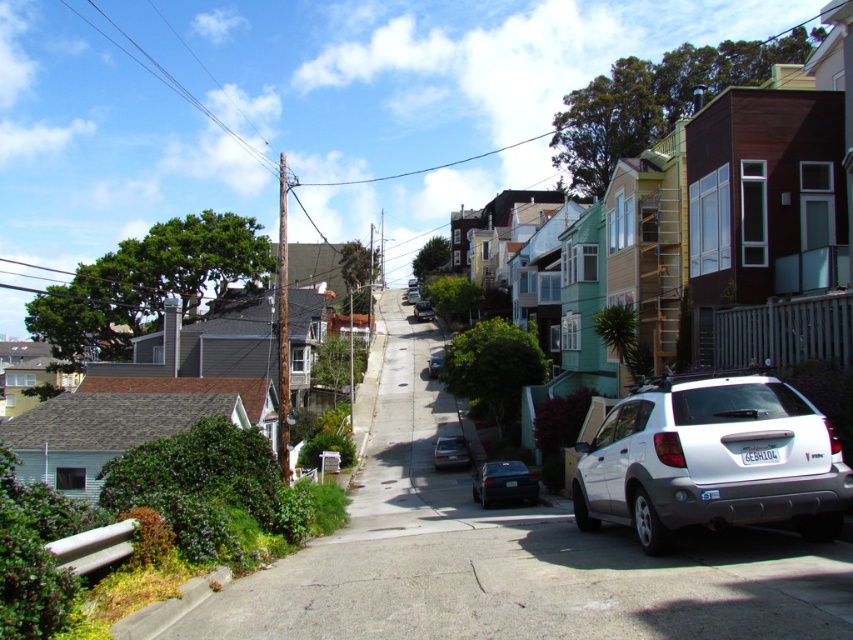
Question: Considering the real-world distances, which object is farthest from the matte black sedan at center?

Choices:
 (A) shiny black sedan at center
 (B) satin black sedan at center
 (C) white matte suv at lower right

Answer: (B)

Question: Does white matte suv at lower right have a larger size compared to shiny black sedan at center?

Choices:
 (A) yes
 (B) no

Answer: (B)

Question: Which point is closer to the camera?

Choices:
 (A) white matte suv at lower right
 (B) metallic silver sedan at center
 (C) shiny black sedan at center

Answer: (A)

Question: Which of the following is the farthest from the observer?

Choices:
 (A) matte black sedan at center
 (B) metallic silver sedan at center
 (C) white matte suv at lower right

Answer: (B)

Question: Can you confirm if white matte suv at lower right is positioned below shiny black sedan at center?

Choices:
 (A) yes
 (B) no

Answer: (B)

Question: Can you confirm if matte black sedan at center is positioned to the left of satin black sedan at center?

Choices:
 (A) no
 (B) yes

Answer: (A)